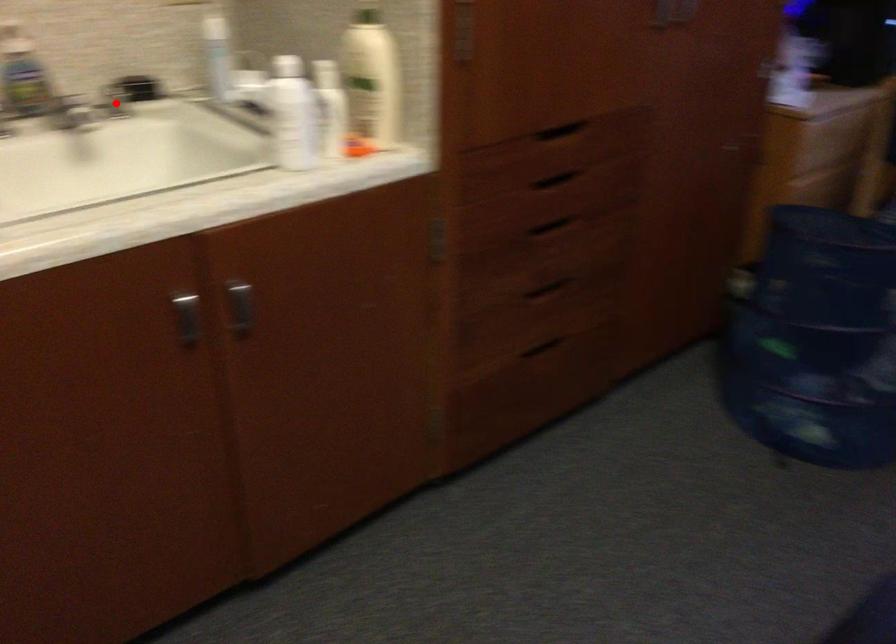
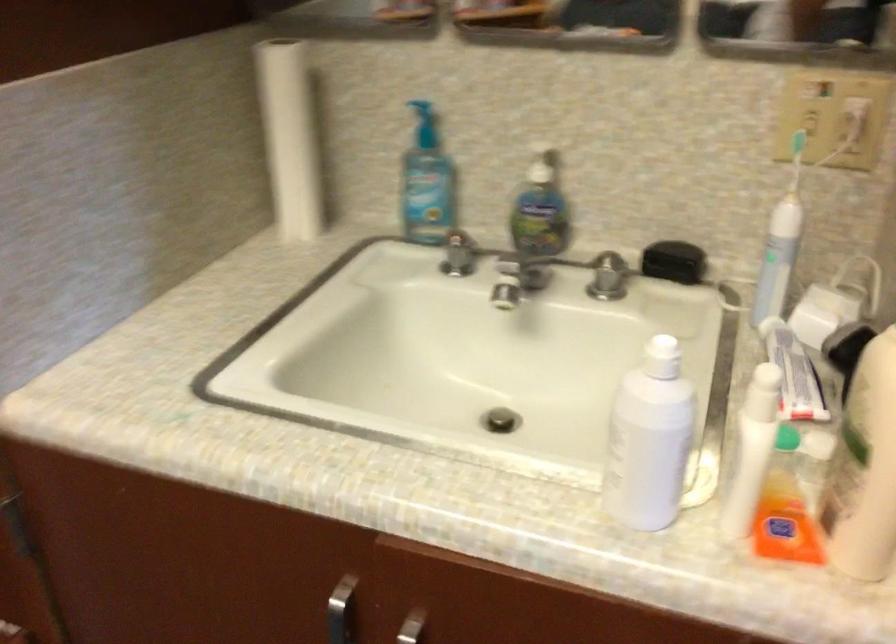
Question: I am providing you with two images of the same scene from different viewpoints. In image1, a red point is highlighted. Considering the same 3D point in image2, which of the following is correct?

Choices:
 (A) It is closer
 (B) It is farther

Answer: (A)